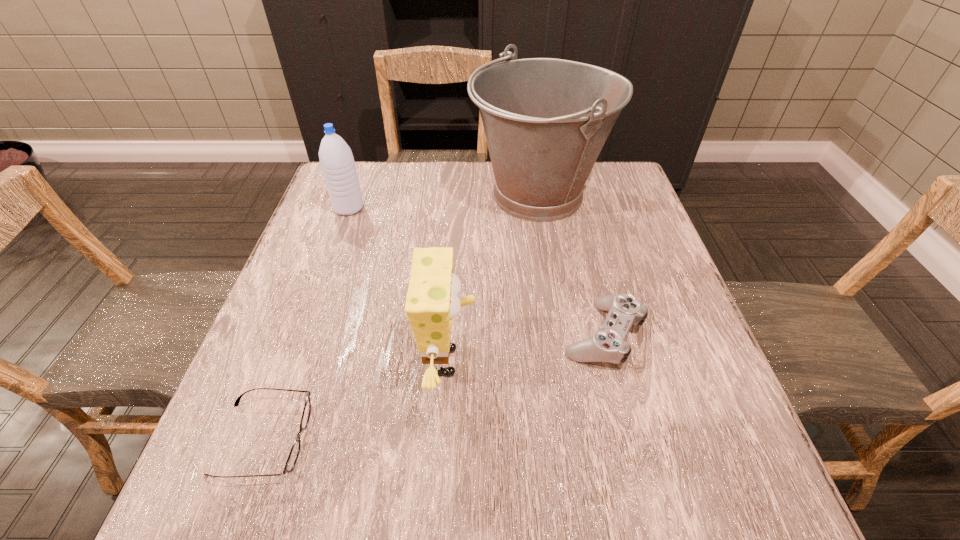
Identify the location of free spot between the sponge and the bucket. (494, 279).

At what (x,y) coordinates should I click in order to perform the action: click on vacant point located between the sponge and the spectacles. Please return your answer as a coordinate pair (x, y). This screenshot has width=960, height=540. Looking at the image, I should click on (356, 400).

Locate an element on the screen. The width and height of the screenshot is (960, 540). free space between the water bottle and the fourth tallest object is located at coordinates (476, 271).

The height and width of the screenshot is (540, 960). I want to click on vacant area that lies between the fourth tallest object and the tallest object, so click(571, 265).

Identify the location of object that can be found as the third closest to the fourth tallest object. (294, 452).

Locate which object ranks second in proximity to the tallest object. Please provide its 2D coordinates. Your answer should be formatted as a tuple, i.e. [(x, y)], where the tuple contains the x and y coordinates of a point satisfying the conditions above.

[(432, 301)]

The image size is (960, 540). I want to click on free location that satisfies the following two spatial constraints: 1. on the front side of the water bottle; 2. on the front-facing side of the shortest object, so click(x=268, y=439).

Identify the location of vacant area that satisfies the following two spatial constraints: 1. on the front side of the water bottle; 2. on the front-facing side of the spectacles. (268, 439).

Identify the location of blank space that satisfies the following two spatial constraints: 1. on the front side of the bucket; 2. on the front-facing side of the sponge. Image resolution: width=960 pixels, height=540 pixels. (567, 361).